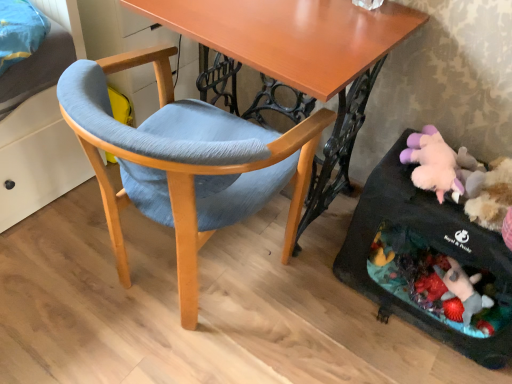
At what (x,y) coordinates should I click in order to perform the action: click on vacant space that's between wooden desk at center and black fabric baby carriage at lower right. Please return your answer as a coordinate pair (x, y). Looking at the image, I should click on (360, 312).